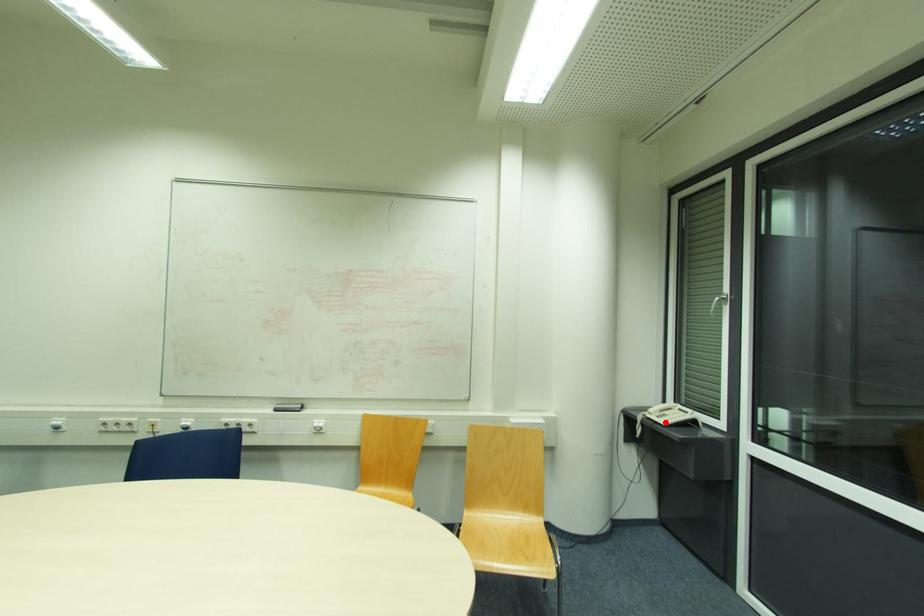
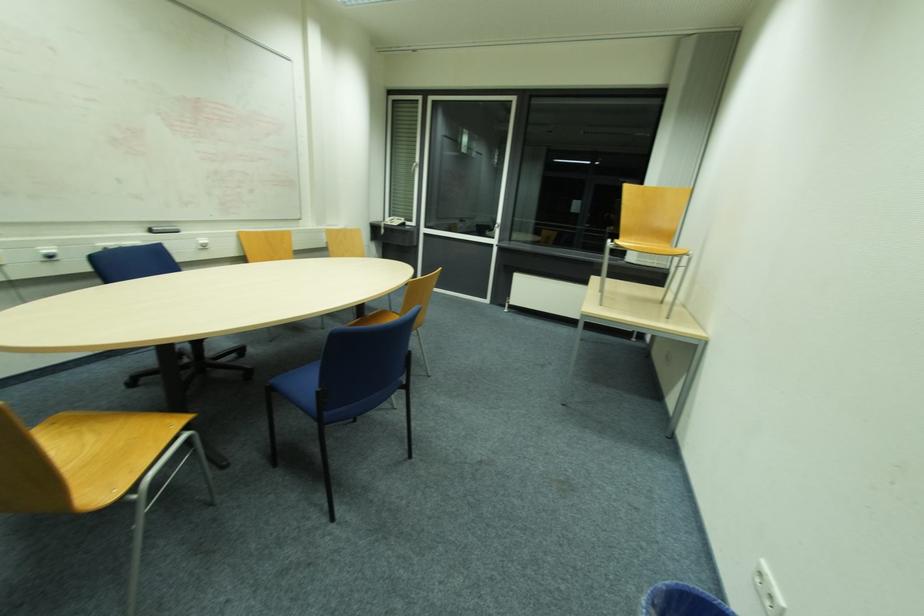
Find the pixel in the second image that matches the highlighted location in the first image.

(397, 225)